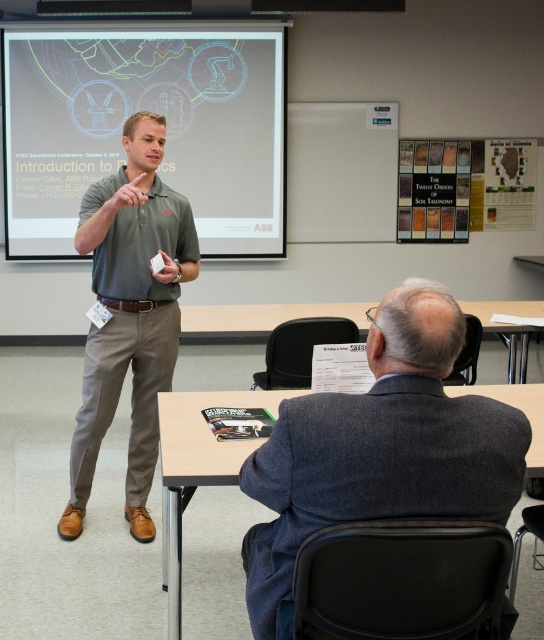
From the picture: Does matte white projector screen at upper center lie in front of dark gray suit at center?

No, it is not.

Consider the image. Can you confirm if matte white projector screen at upper center is taller than dark gray suit at center?

Yes, matte white projector screen at upper center is taller than dark gray suit at center.

I want to click on matte white projector screen at upper center, so click(x=151, y=109).

Does matte white projector screen at upper center have a larger size compared to matte gray shirt at center?

Yes, matte white projector screen at upper center is bigger than matte gray shirt at center.

Does point (83, 32) lie in front of point (132, 195)?

That is False.

Does point (213, 112) come closer to viewer compared to point (144, 394)?

No, it is not.

Where is `matte white projector screen at upper center`? The width and height of the screenshot is (544, 640). matte white projector screen at upper center is located at coordinates (151, 109).

Can you confirm if dark gray suit at center is shorter than matte gray shirt at center?

Yes, dark gray suit at center is shorter than matte gray shirt at center.

Is point (503, 449) closer to camera compared to point (71, 449)?

Yes, it is in front of point (71, 449).

You are a GUI agent. You are given a task and a screenshot of the screen. Output one action in this format:
    pyautogui.click(x=<x>, y=<y>)
    Task: Click on the dark gray suit at center
    The width and height of the screenshot is (544, 640).
    Given the screenshot: What is the action you would take?
    pyautogui.click(x=380, y=448)